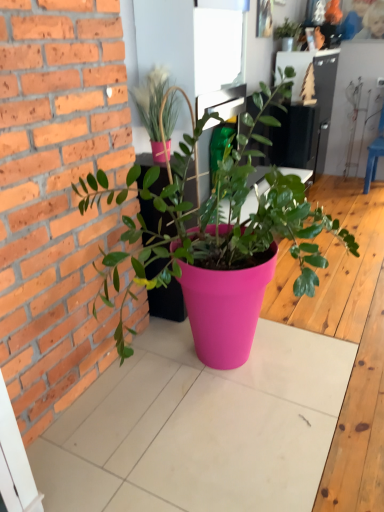
Question: Which direction should I rotate to face matte pink pot at upper center, which is the 2th houseplant from back to front, — up or down?

Choices:
 (A) up
 (B) down

Answer: (A)

Question: From the image's perspective, is matte green plant at upper center, the first houseplant positioned from the top, below blue plastic chair at right?

Choices:
 (A) yes
 (B) no

Answer: (B)

Question: Is matte green plant at upper center, the third houseplant when ordered from bottom to top, turned away from blue plastic chair at right?

Choices:
 (A) no
 (B) yes

Answer: (A)

Question: From the image's perspective, would you say matte green plant at upper center, the 3th houseplant viewed from the front, is positioned over blue plastic chair at right?

Choices:
 (A) yes
 (B) no

Answer: (A)

Question: From a real-world perspective, is matte green plant at upper center, the third houseplant when ordered from bottom to top, positioned under blue plastic chair at right based on gravity?

Choices:
 (A) no
 (B) yes

Answer: (A)

Question: Is matte green plant at upper center, which ranks as the first houseplant in back-to-front order, shorter than blue plastic chair at right?

Choices:
 (A) yes
 (B) no

Answer: (A)

Question: Is matte green plant at upper center, the third houseplant when ordered from bottom to top, smaller than blue plastic chair at right?

Choices:
 (A) yes
 (B) no

Answer: (A)

Question: Is the depth of matte pink pot at upper center, acting as the second houseplant starting from the bottom, less than that of matte green plant at upper center, which ranks as the first houseplant in back-to-front order?

Choices:
 (A) yes
 (B) no

Answer: (A)

Question: Is matte pink pot at upper center, which is the 2th houseplant from back to front, behind matte green plant at upper center, the first houseplant positioned from the top?

Choices:
 (A) yes
 (B) no

Answer: (B)

Question: Does matte pink pot at upper center, acting as the second houseplant starting from the bottom, have a greater height compared to matte green plant at upper center, the third houseplant when ordered from bottom to top?

Choices:
 (A) no
 (B) yes

Answer: (B)

Question: From a real-world perspective, is matte pink pot at upper center, the second houseplant in the front-to-back sequence, below matte green plant at upper center, the third houseplant when ordered from bottom to top?

Choices:
 (A) no
 (B) yes

Answer: (B)

Question: Is the surface of matte pink pot at upper center, the second houseplant in the front-to-back sequence, in direct contact with matte green plant at upper center, the first houseplant positioned from the top?

Choices:
 (A) yes
 (B) no

Answer: (B)

Question: Is matte pink pot at upper center, the second houseplant in the front-to-back sequence, at the right side of matte green plant at upper center, which ranks as the first houseplant in back-to-front order?

Choices:
 (A) no
 (B) yes

Answer: (A)

Question: Does matte green plant at upper center, the first houseplant positioned from the top, have a smaller size compared to pink plastic pot at center, marked as the 1th houseplant in a bottom-to-top arrangement?

Choices:
 (A) no
 (B) yes

Answer: (B)